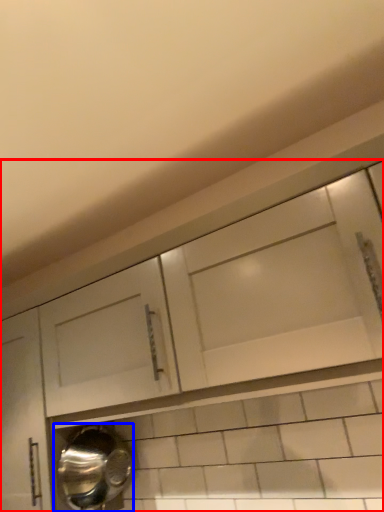
Question: Which of the following is the farthest to the observer, cabinetry (highlighted by a red box) or water heater (highlighted by a blue box)?

Choices:
 (A) cabinetry
 (B) water heater

Answer: (B)